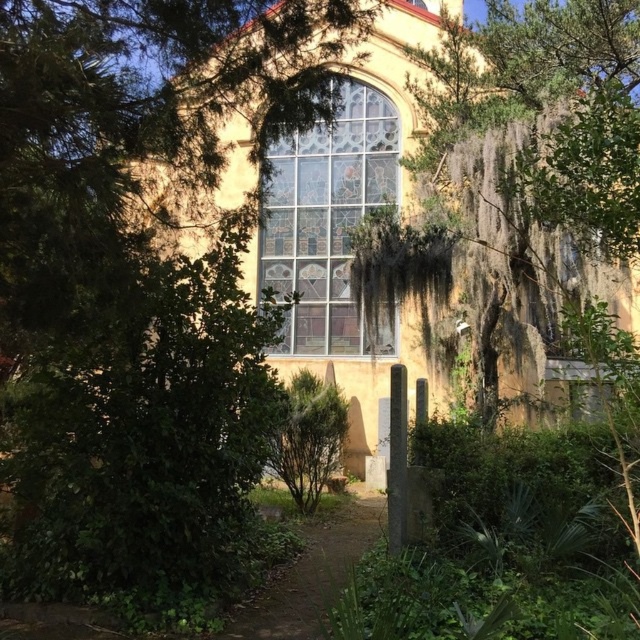
Question: Which object appears closest to the camera in this image?

Choices:
 (A) brown dirt path at center
 (B) stained glass window at center

Answer: (A)

Question: Is yellow stucco church at center closer to the viewer compared to stained glass window at center?

Choices:
 (A) no
 (B) yes

Answer: (B)

Question: Which point is farther to the camera?

Choices:
 (A) brown dirt path at center
 (B) stained glass window at center

Answer: (B)

Question: Is stained glass window at center to the left of brown dirt path at center from the viewer's perspective?

Choices:
 (A) yes
 (B) no

Answer: (B)

Question: Which point is closer to the camera taking this photo?

Choices:
 (A) (310, 172)
 (B) (364, 515)
 (C) (509, 138)

Answer: (C)

Question: Can you confirm if yellow stucco church at center is positioned to the right of stained glass window at center?

Choices:
 (A) no
 (B) yes

Answer: (B)